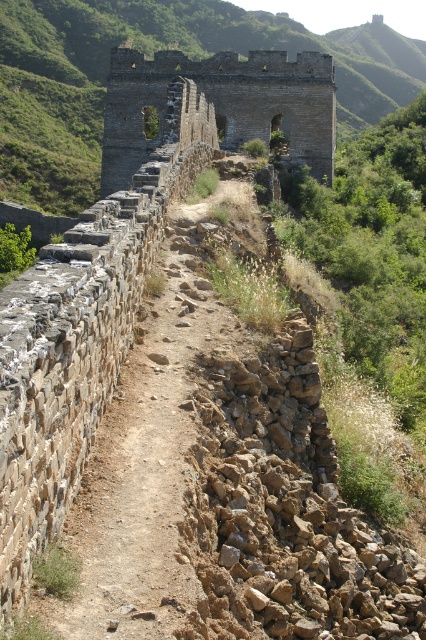
You are standing on the brown stone path at center and looking towards the stone wall at center. Which object is closer to you?

The brown stone path at center is closer to you than the stone wall at center.

You are standing on the Great Wall of China and want to walk along the brown stone path at center. Based on its 2D coordinates, in which general direction should you look to find the path?

The brown stone path at center is located at coordinates approximately 0.722 on the x axis and 0.359 on the y axis. Since the x coordinate is closer to 1, it is positioned more to the right side of the image, and the y coordinate closer to 0.5 places it near the center vertically. Therefore, you should look towards the right side of the image to find the path.

You are a hiker planning to walk along the brown stone path at center on the Great Wall. The stone wall at center is part of the structure. Considering their sizes, which one would you say is wider?

The brown stone path at center is smaller than the stone wall at center, so the stone wall at center is wider.